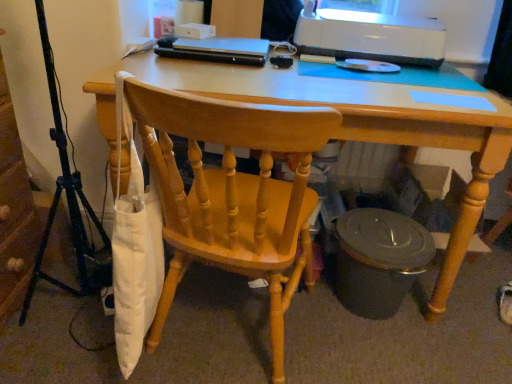
Where is `vacant space to the left of matte black trash can at lower right`? The image size is (512, 384). vacant space to the left of matte black trash can at lower right is located at coordinates (295, 305).